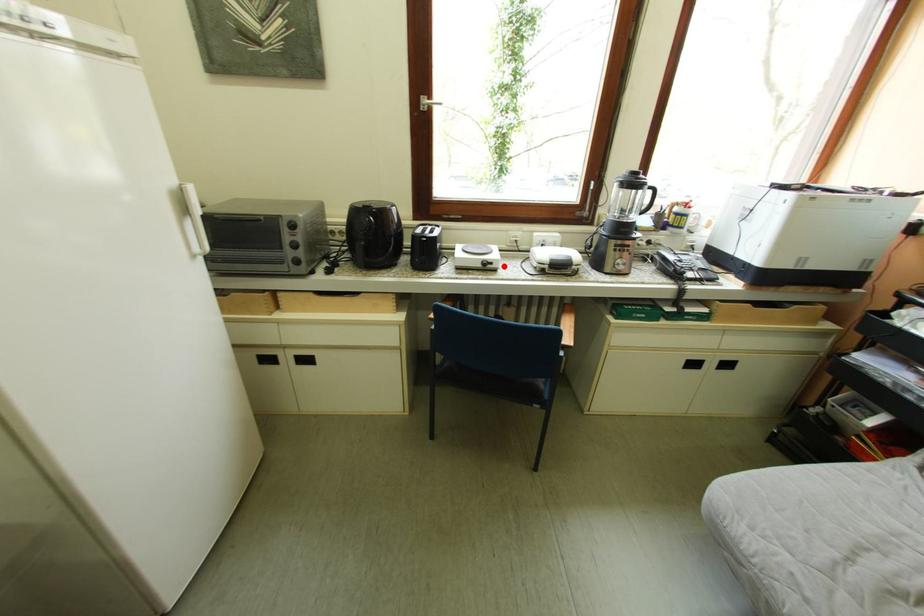
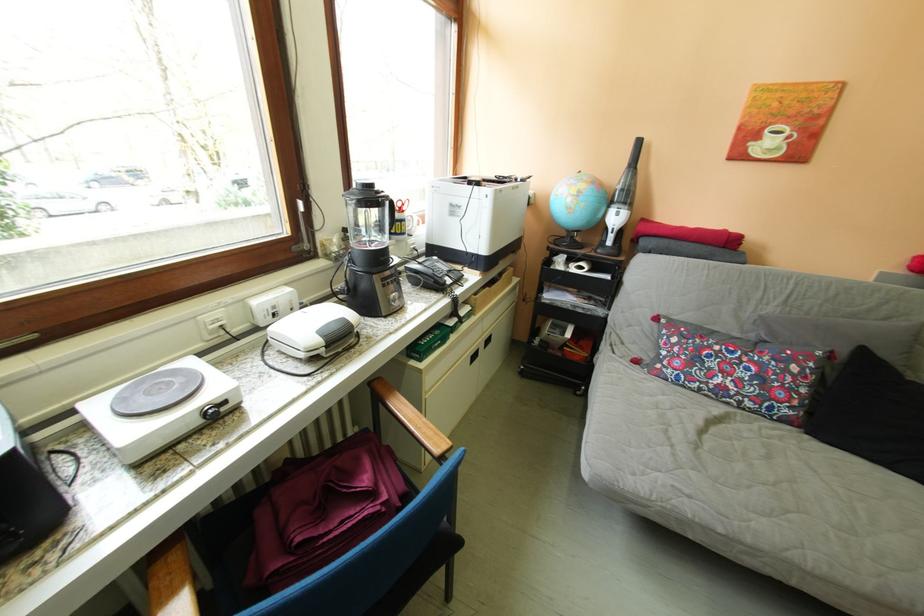
In the second image, find the point that corresponds to the highlighted location in the first image.

(237, 406)